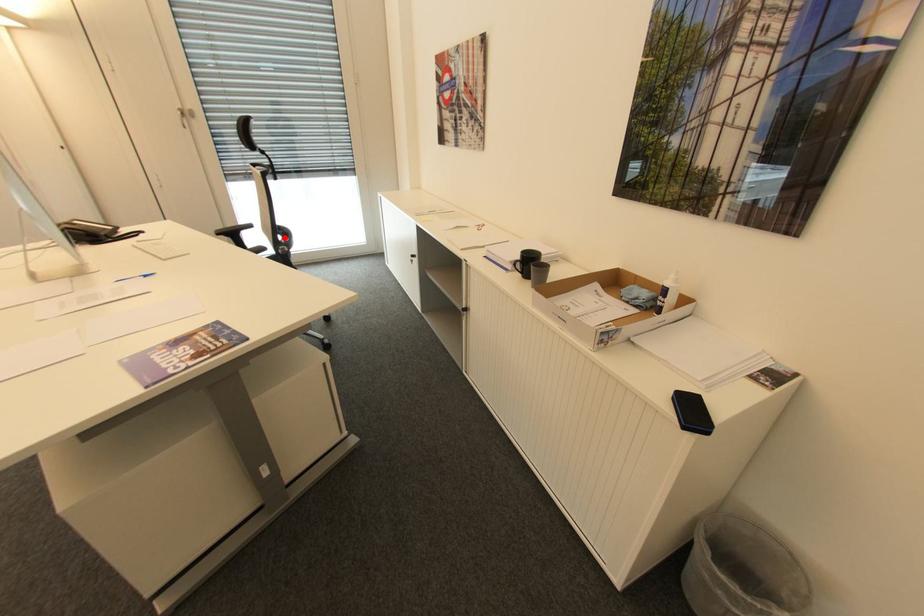
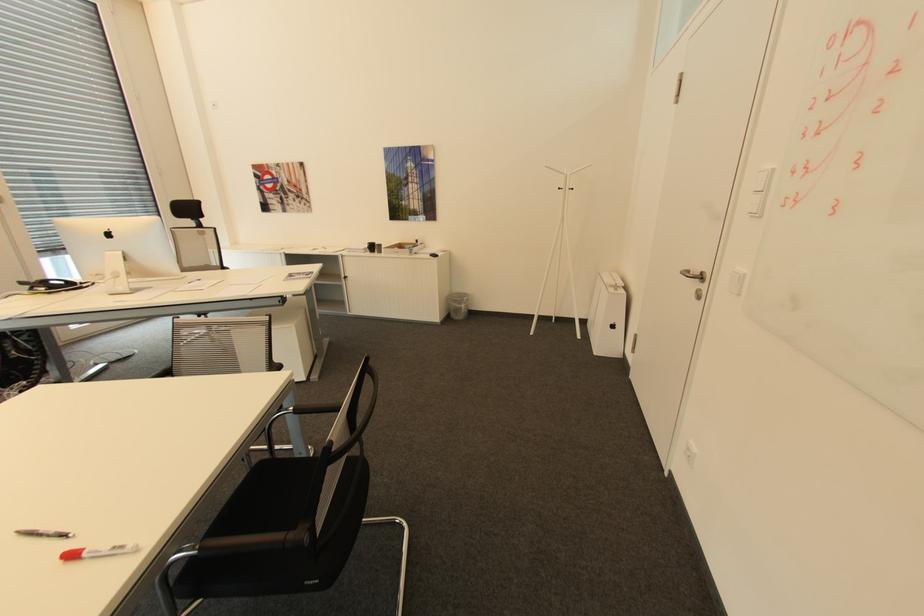
Question: I am providing you with two images of the same scene from different viewpoints. A red point is marked on the first image. Is the red point's position out of view in image 2?

Choices:
 (A) Yes
 (B) No

Answer: (A)